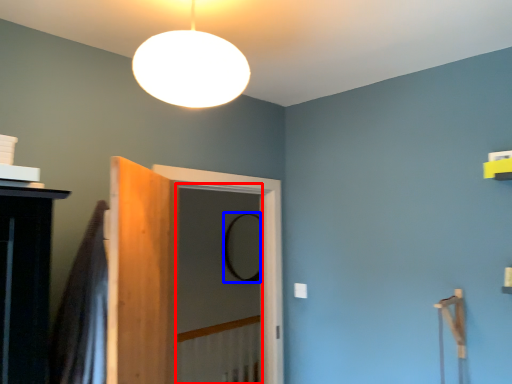
Question: Which of the following is the closest to the observer, screen door (highlighted by a red box) or mirror (highlighted by a blue box)?

Choices:
 (A) screen door
 (B) mirror

Answer: (A)